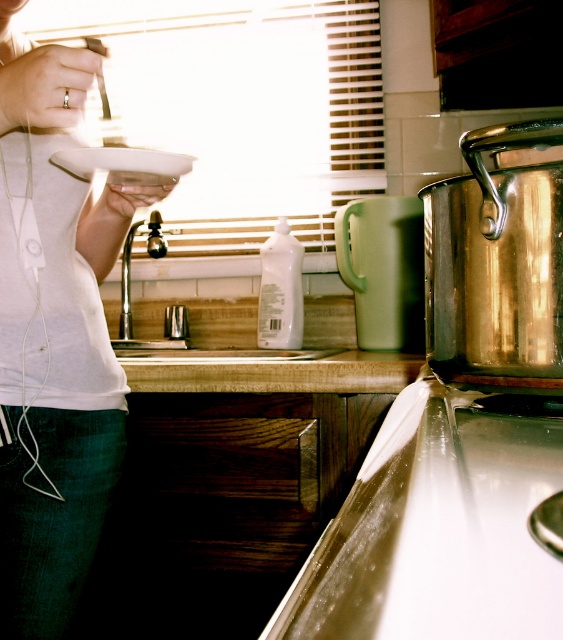
You are a delivery person who needs to place a small rectangular package between the white matte shirt at upper left and the white glossy sink at center. Can you fit it there?

The white matte shirt at upper left is thinner than the white glossy sink at center, so there is space between them. The small rectangular package can be placed there.